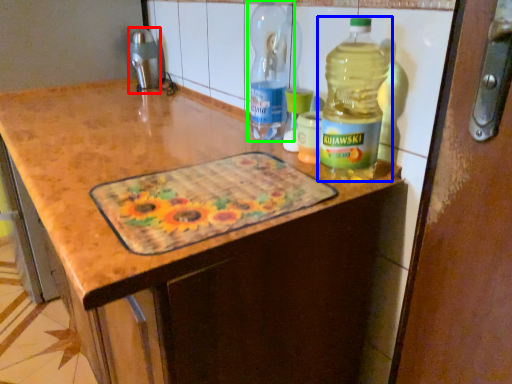
Question: Based on their relative distances, which object is farther from appliance (highlighted by a red box)? Choose from bottle (highlighted by a blue box) and bottle (highlighted by a green box).

Choices:
 (A) bottle
 (B) bottle

Answer: (A)